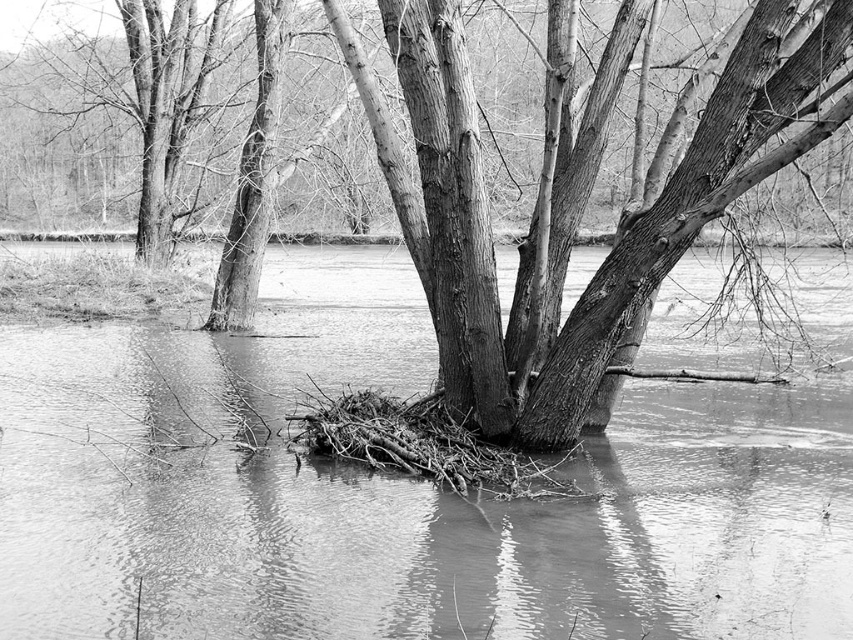
You are standing on the bank of the flooded area and see the smooth water at center and the rough bark tree at center. Which object is closer to your feet?

The smooth water at center is located below the rough bark tree at center, so the smooth water at center is closer to your feet.